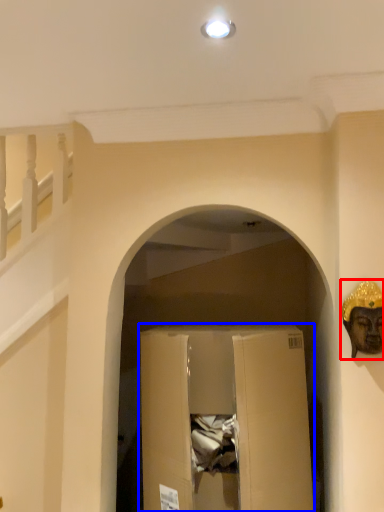
Question: Which of the following is the farthest to the observer, construction worker (highlighted by a red box) or cardboard box (highlighted by a blue box)?

Choices:
 (A) construction worker
 (B) cardboard box

Answer: (B)